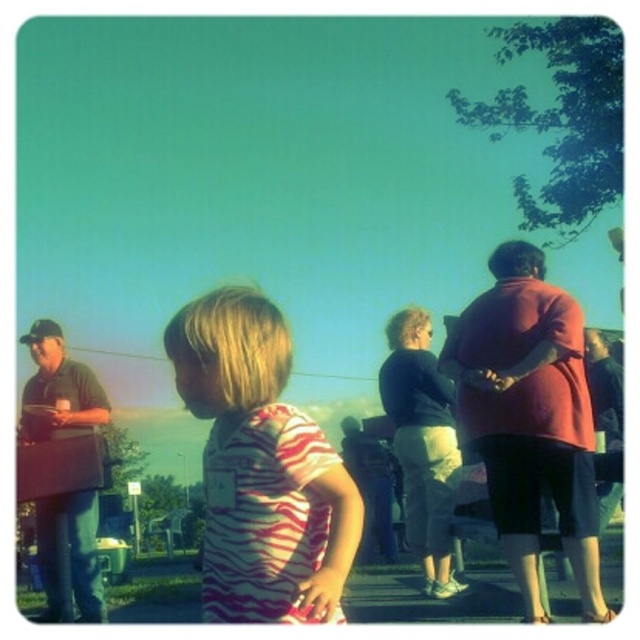
Based on the photo, between zebra-striped shirt at center and matte red jacket at right, which one appears on the left side from the viewer's perspective?

zebra-striped shirt at center

From the picture: Who is taller, zebra-striped shirt at center or matte red jacket at right?

matte red jacket at right is taller.

Which is in front, point (268, 362) or point (531, 250)?

Point (268, 362) is in front.

This screenshot has width=640, height=640. Identify the location of zebra-striped shirt at center. (260, 467).